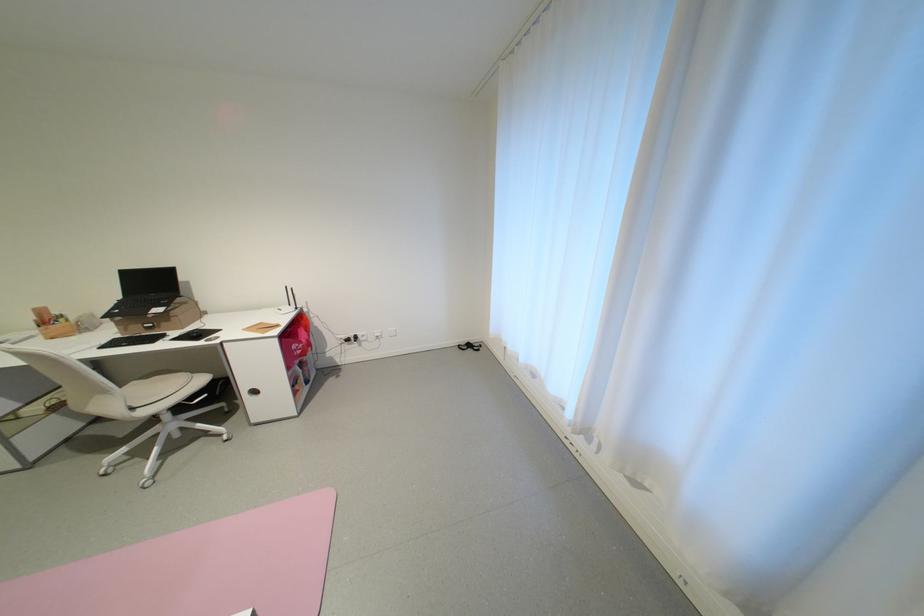
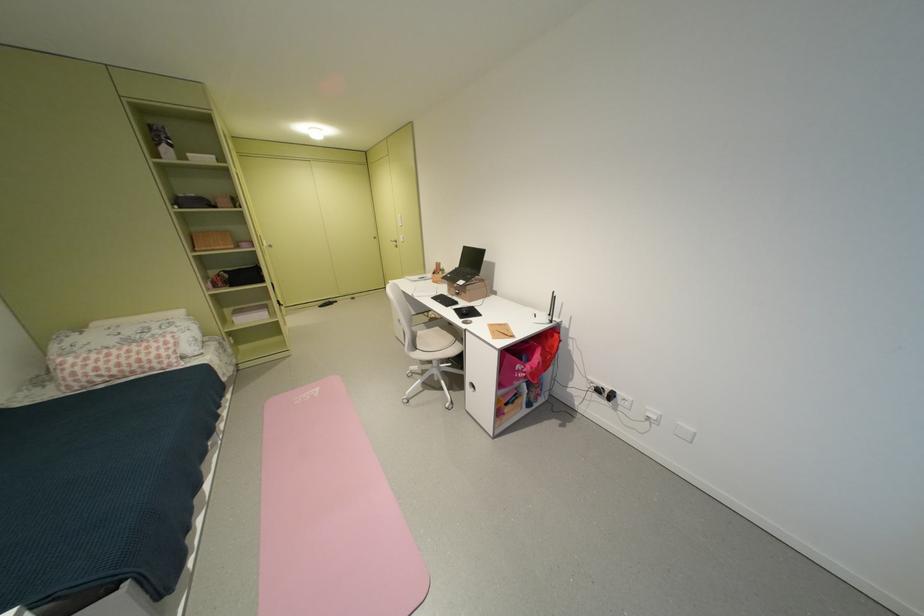
Where in the second image is the point corresponding to the point at 146,408 from the first image?

(428, 349)